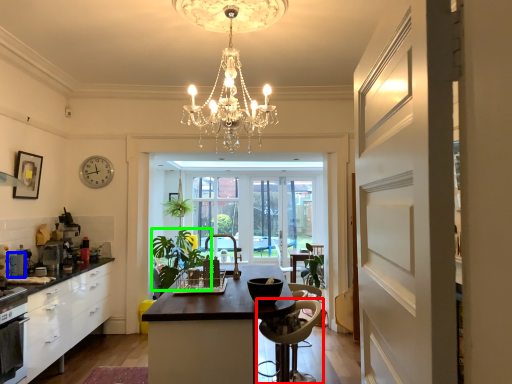
Question: Based on their relative distances, which object is nearer to chair (highlighted by a red box)? Choose from appliance (highlighted by a blue box) and plant (highlighted by a green box).

Choices:
 (A) appliance
 (B) plant

Answer: (A)